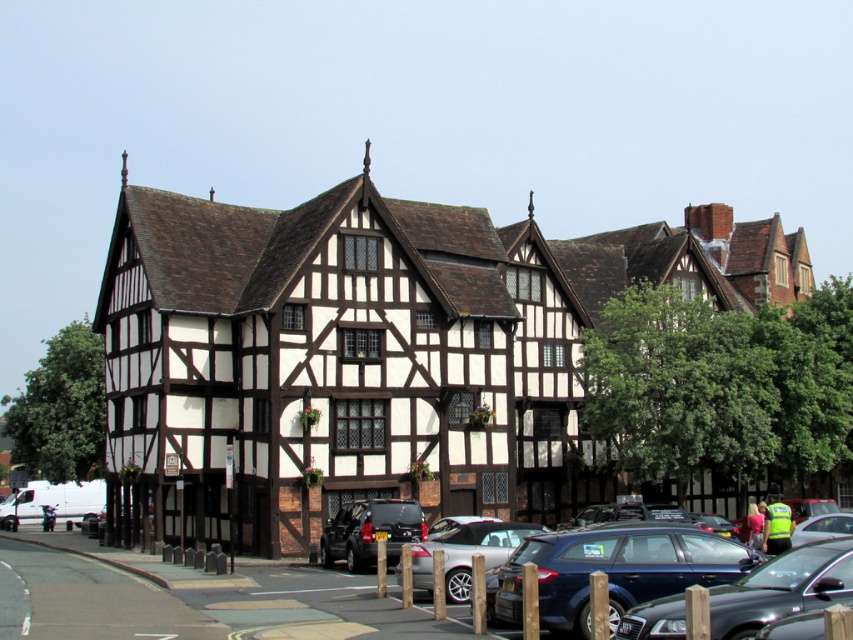
What do you see at coordinates (614, 570) in the screenshot? I see `metallic blue hatchback at center` at bounding box center [614, 570].

Which of these two, metallic blue hatchback at center or silver metallic car at lower center, stands taller?

With more height is silver metallic car at lower center.

The width and height of the screenshot is (853, 640). Describe the element at coordinates (614, 570) in the screenshot. I see `metallic blue hatchback at center` at that location.

Where is `metallic blue hatchback at center`? The height and width of the screenshot is (640, 853). metallic blue hatchback at center is located at coordinates (614, 570).

Who is taller, metallic blue sedan at center or metallic blue hatchback at center?

Standing taller between the two is metallic blue sedan at center.

Is metallic blue sedan at center to the left of metallic blue hatchback at center from the viewer's perspective?

Incorrect, metallic blue sedan at center is not on the left side of metallic blue hatchback at center.

Does point (625, 595) come behind point (651, 582)?

That is False.

Image resolution: width=853 pixels, height=640 pixels. In order to click on metallic blue sedan at center in this screenshot , I will do `click(648, 572)`.

Between point (503, 582) and point (463, 531), which one is positioned in front?

Point (503, 582) is more forward.

Is metallic blue sedan at center bigger than silver metallic car at lower center?

Yes, metallic blue sedan at center is bigger than silver metallic car at lower center.

Is point (665, 524) positioned behind point (469, 548)?

No.

Find the location of a particular element. Image resolution: width=853 pixels, height=640 pixels. metallic blue sedan at center is located at coordinates (648, 572).